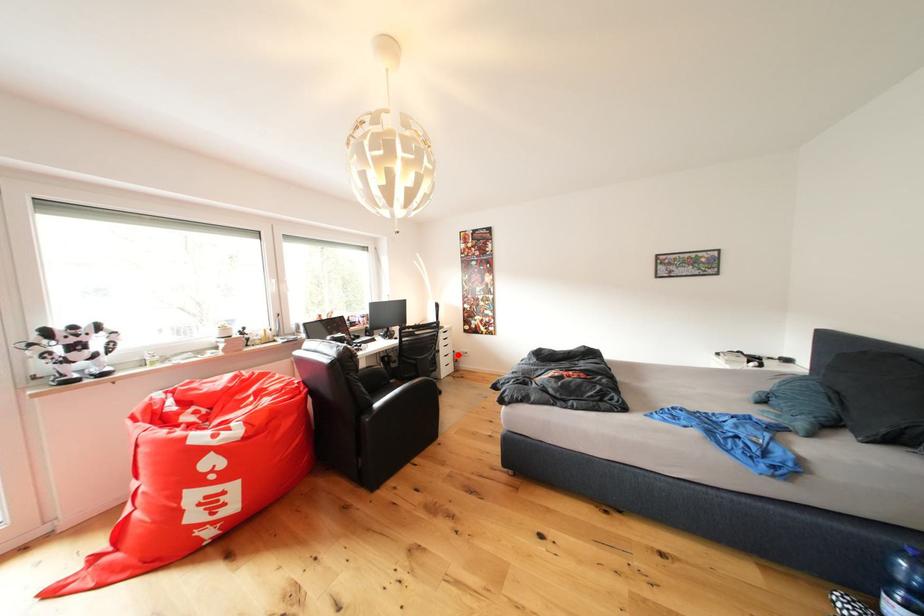
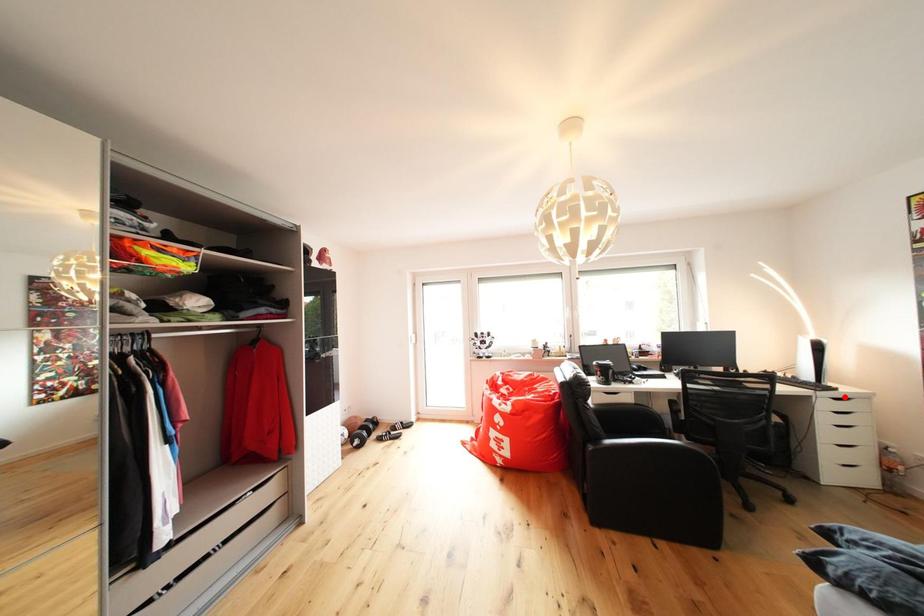
I am providing you with two images of the same scene from different viewpoints. A red point is marked on the first image and another point is marked on the second image. Are the points marked in image1 and image2 representing the same 3D position?

No